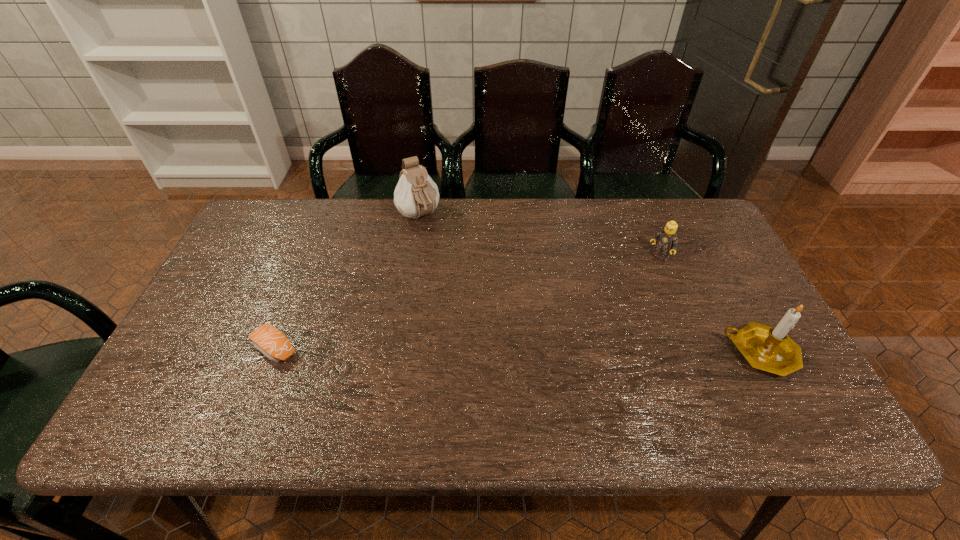
Where is `free space on the desktop that is between the leftmost object and the rightmost object and is positioned in front of the second farthest object`? The width and height of the screenshot is (960, 540). free space on the desktop that is between the leftmost object and the rightmost object and is positioned in front of the second farthest object is located at coordinates (562, 350).

This screenshot has width=960, height=540. Find the location of `vacant spot on the desktop that is between the shortest object and the candle holder and is positioned on the front-facing side of the second object from left to right`. vacant spot on the desktop that is between the shortest object and the candle holder and is positioned on the front-facing side of the second object from left to right is located at coordinates (535, 350).